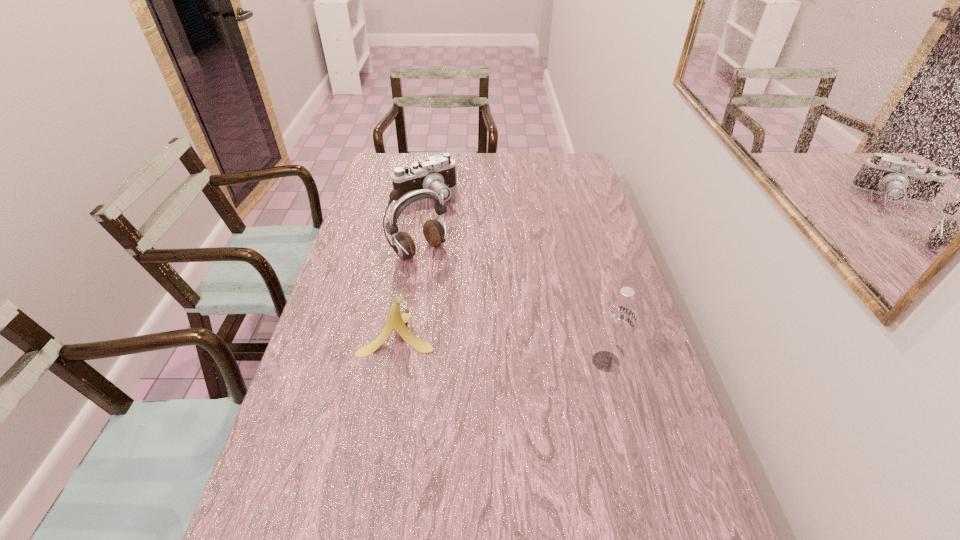
Locate an element on the screen. The height and width of the screenshot is (540, 960). vacant spot on the desktop that is between the banana and the rightmost object and is positioned at the lens of the farthest object is located at coordinates (515, 349).

Find the location of a particular element. vacant space on the desktop that is between the banana and the vodka and is positioned on the ear pads of the third nearest object is located at coordinates (520, 349).